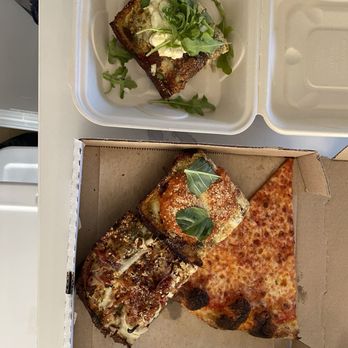
Locate an element on the screen. table is located at coordinates (50, 176).